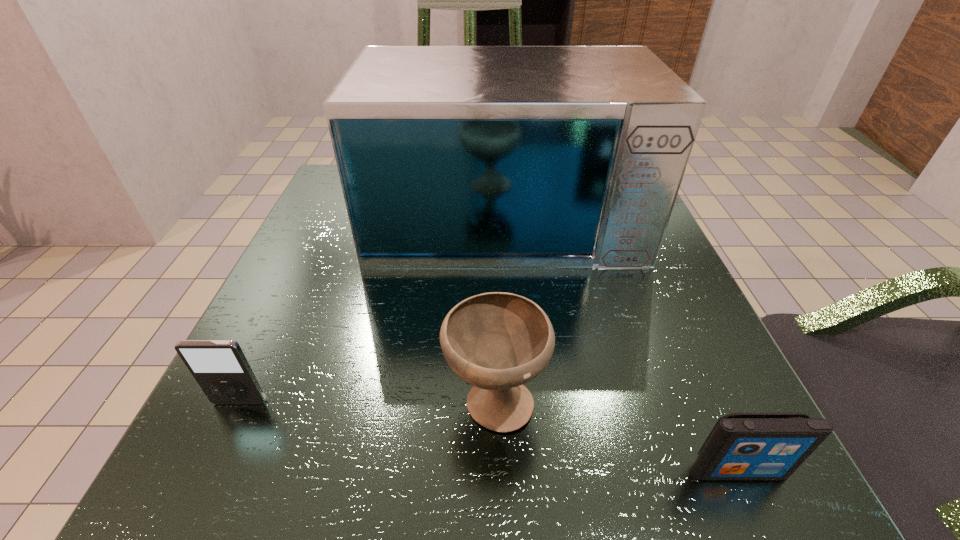
Identify the location of object that is at the far edge. (448, 156).

Locate an element on the screen. chalice positioned at the near edge is located at coordinates (496, 341).

This screenshot has width=960, height=540. I want to click on iPod positioned at the near edge, so click(x=741, y=446).

The width and height of the screenshot is (960, 540). Identify the location of microwave oven that is at the left edge. (448, 156).

Identify the location of iPod that is at the left edge. The height and width of the screenshot is (540, 960). (221, 369).

At what (x,y) coordinates should I click in order to perform the action: click on microwave oven located in the right edge section of the desktop. Please return your answer as a coordinate pair (x, y). Looking at the image, I should click on (448, 156).

The width and height of the screenshot is (960, 540). What are the coordinates of `iPod at the right edge` in the screenshot? It's located at (741, 446).

Where is `object that is at the far left corner`? This screenshot has width=960, height=540. object that is at the far left corner is located at coordinates (448, 156).

Image resolution: width=960 pixels, height=540 pixels. Identify the location of object that is at the far right corner. (448, 156).

You are a GUI agent. You are given a task and a screenshot of the screen. Output one action in this format:
    pyautogui.click(x=<x>, y=<y>)
    Task: Click on the object situated at the near right corner
    The image size is (960, 540).
    Given the screenshot: What is the action you would take?
    pyautogui.click(x=741, y=446)